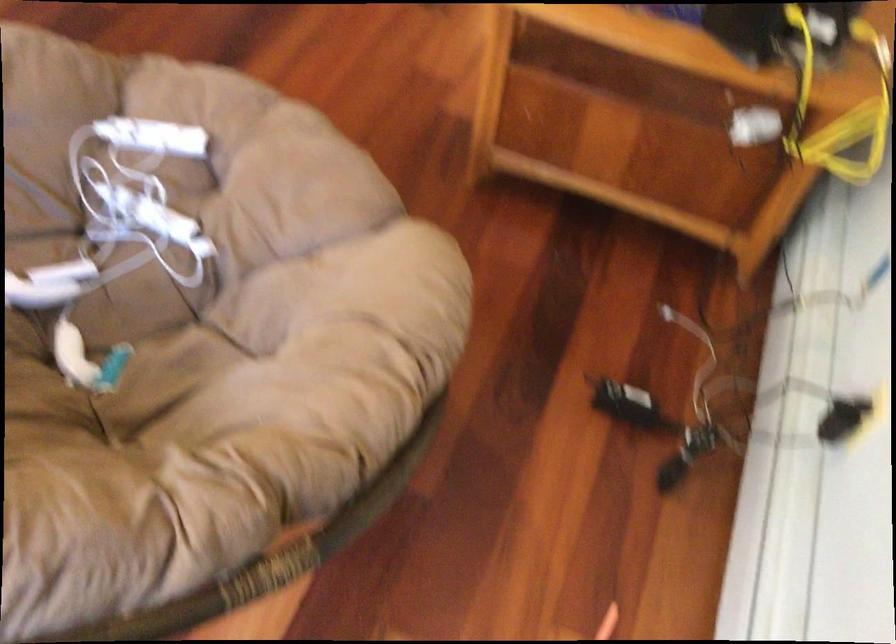
Which object does [113,236] point to?

It refers to a white game controller.